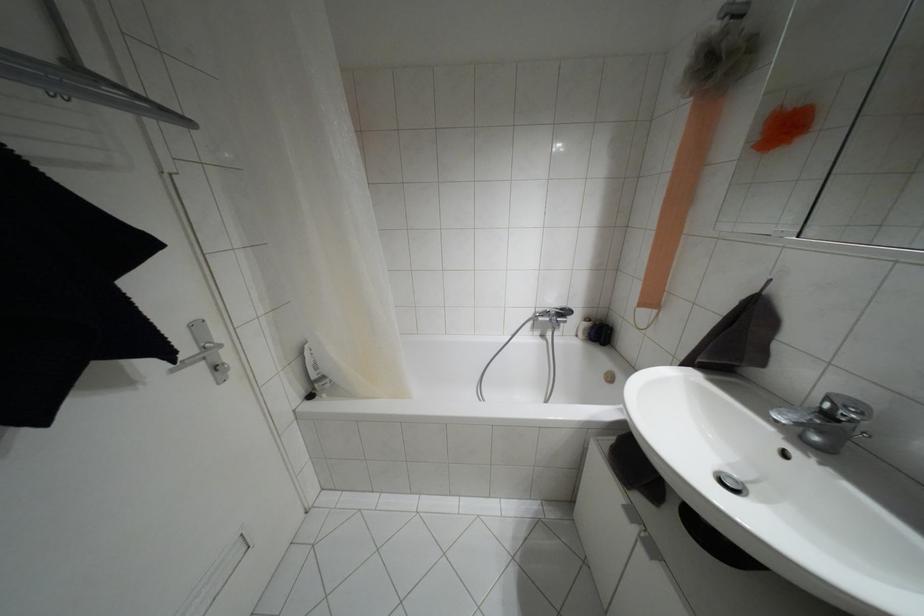
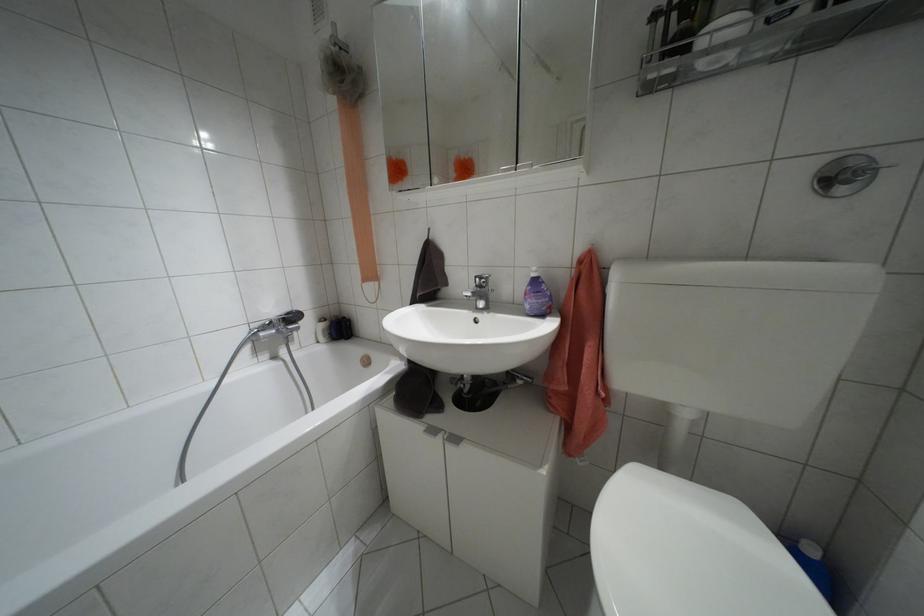
In the second image, find the point that corresponds to [825,414] in the first image.

(479, 286)